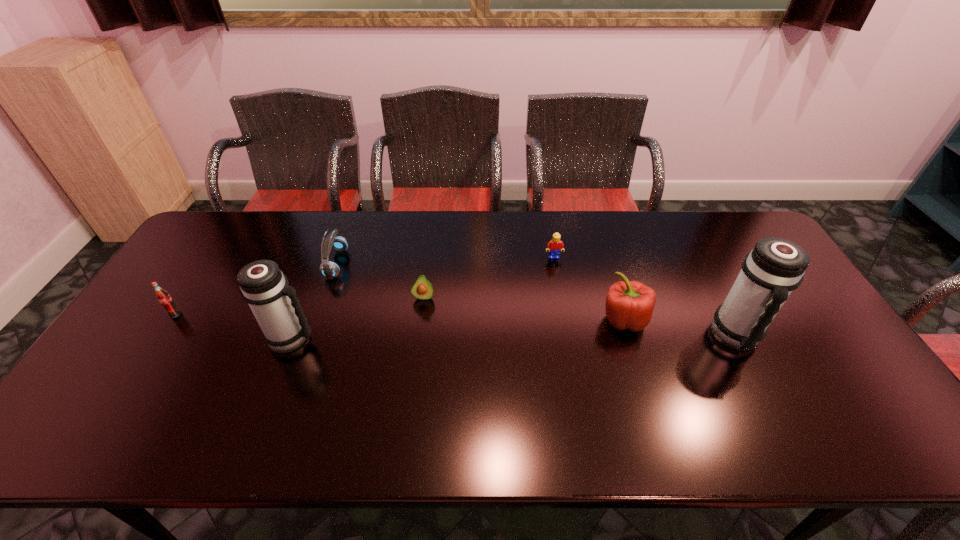
Please point a space for a new thermos_bottle to maintain equal intervals. Please provide its 2D coordinates. Your answer should be formatted as a tuple, i.e. [(x, y)], where the tuple contains the x and y coordinates of a point satisfying the conditions above.

[(515, 337)]